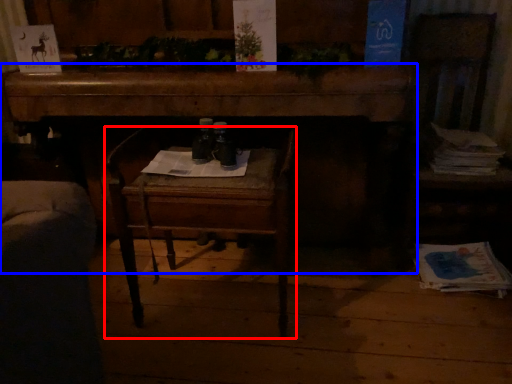
Question: Which object appears farthest to the camera in this image, chair (highlighted by a red box) or desk (highlighted by a blue box)?

Choices:
 (A) chair
 (B) desk

Answer: (B)